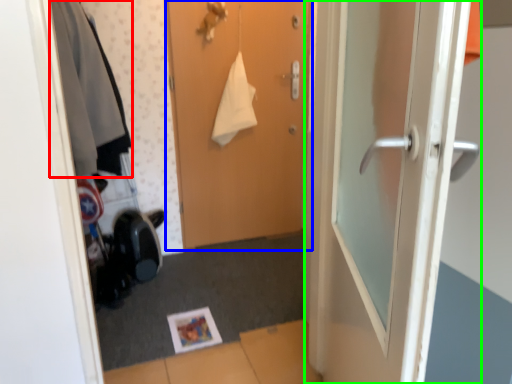
Question: Considering the real-world distances, which object is closest to clothing (highlighted by a red box)? door (highlighted by a blue box) or door (highlighted by a green box).

Choices:
 (A) door
 (B) door

Answer: (A)